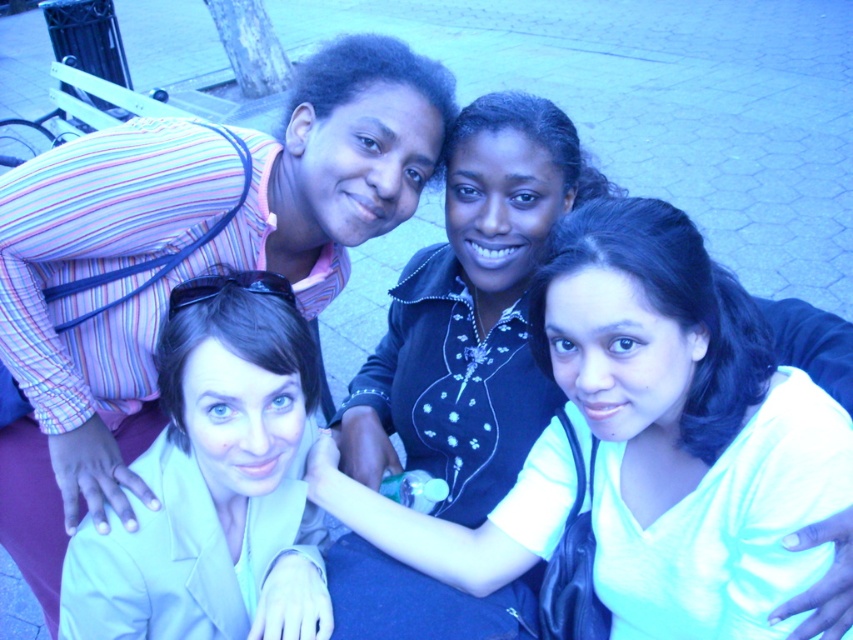
Which is behind, point (798, 560) or point (163, 445)?

The point (163, 445) is more distant.

What do you see at coordinates (683, 428) in the screenshot? The image size is (853, 640). I see `light blue fabric at center` at bounding box center [683, 428].

Image resolution: width=853 pixels, height=640 pixels. I want to click on light blue fabric at center, so click(683, 428).